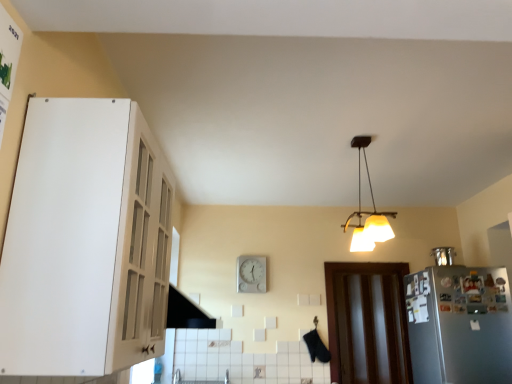
This screenshot has width=512, height=384. I want to click on vacant region above matte yellow lampshade at upper center (from a real-world perspective), so click(x=360, y=136).